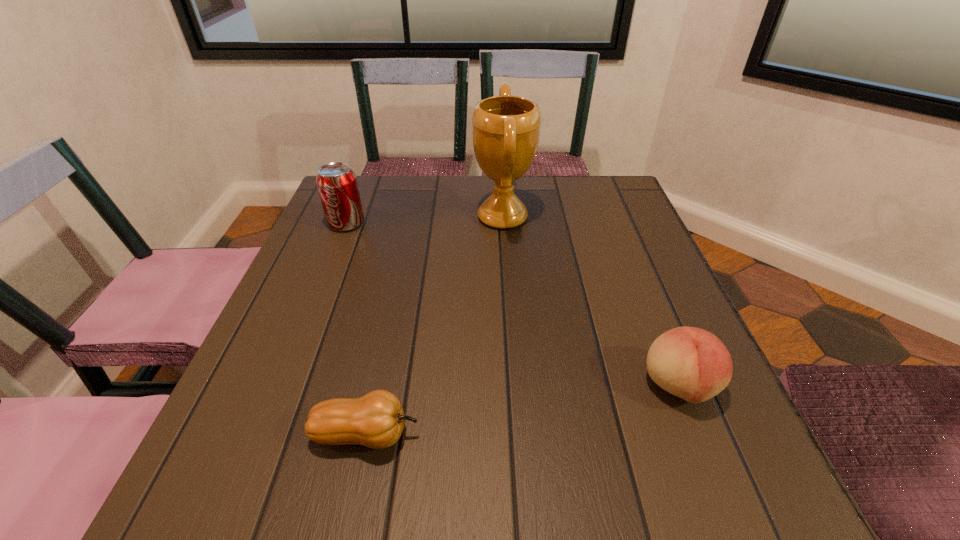
This screenshot has height=540, width=960. What are the coordinates of `object that is at the far left corner` in the screenshot? It's located at (337, 185).

Identify the location of object present at the near left corner. (376, 420).

This screenshot has width=960, height=540. In the image, there is a desktop. In order to click on vacant space at the far edge in this screenshot , I will do `click(401, 212)`.

In the image, there is a desktop. Identify the location of vacant space at the near edge. The width and height of the screenshot is (960, 540). (455, 490).

At what (x,y) coordinates should I click in order to perform the action: click on vacant point at the left edge. Please return your answer as a coordinate pair (x, y). Looking at the image, I should click on (272, 451).

Identify the location of blank space at the right edge. (688, 449).

Locate an element on the screen. This screenshot has width=960, height=540. vacant point at the far left corner is located at coordinates (389, 192).

What are the coordinates of `free space at the near left corner` in the screenshot? It's located at (293, 492).

The width and height of the screenshot is (960, 540). Find the location of `vacant region at the far right corner of the desktop`. vacant region at the far right corner of the desktop is located at coordinates (602, 194).

The width and height of the screenshot is (960, 540). I want to click on unoccupied area between the peach and the soda can, so click(x=513, y=305).